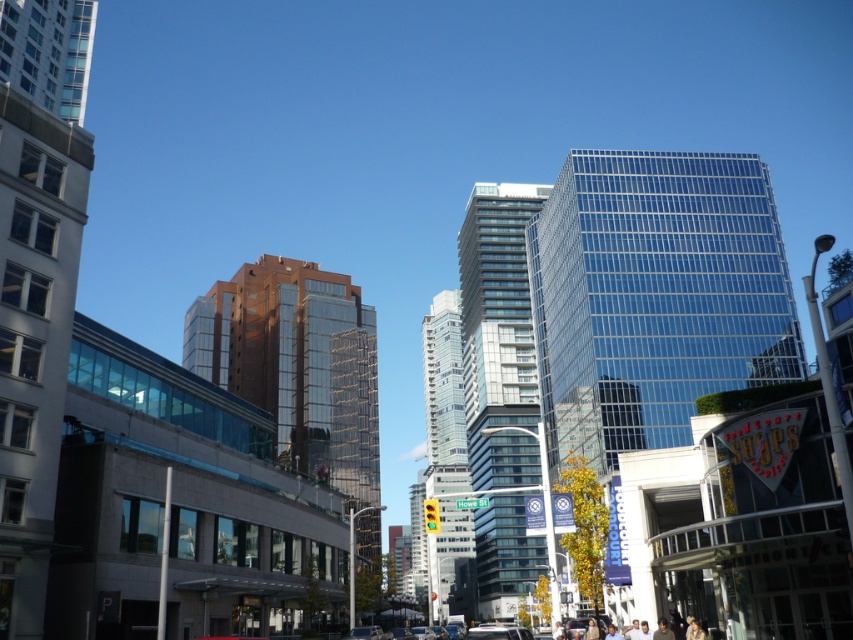
Question: Which point is closer to the camera taking this photo?

Choices:
 (A) pos(519,300)
 (B) pos(648,396)

Answer: (B)

Question: Does transparent glass skyscraper at center come in front of glassy reflective building at center?

Choices:
 (A) yes
 (B) no

Answer: (A)

Question: Based on their relative distances, which object is nearer to the brown glass building at center?

Choices:
 (A) glassy reflective skyscraper at center
 (B) glassy reflective building at center
 (C) transparent glass skyscraper at center

Answer: (C)

Question: Among these points, which one is farthest from the camera?

Choices:
 (A) (532, 259)
 (B) (508, 202)

Answer: (B)

Question: Is transparent glass skyscraper at center bigger than glassy reflective building at center?

Choices:
 (A) yes
 (B) no

Answer: (A)

Question: Considering the relative positions of transparent glass skyscraper at center and glassy reflective skyscraper at center in the image provided, where is transparent glass skyscraper at center located with respect to glassy reflective skyscraper at center?

Choices:
 (A) right
 (B) left

Answer: (A)